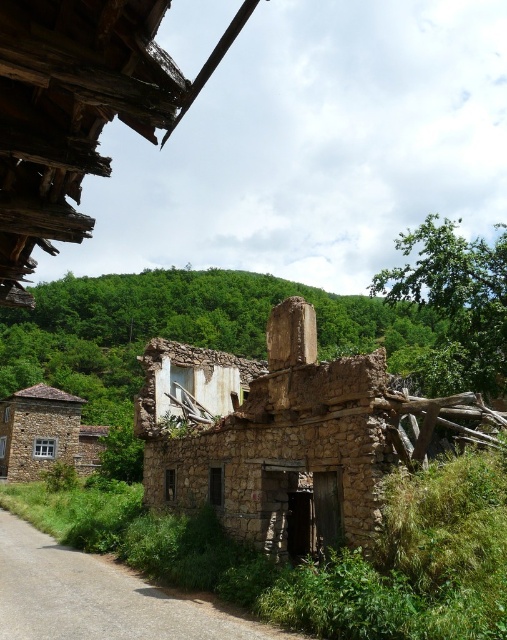
Which is in front, point (295, 401) or point (28, 477)?

Point (295, 401) is more forward.

Does stone rubble at center lie behind stone/tiled hut at lower left?

No.

The width and height of the screenshot is (507, 640). In order to click on stone rubble at center in this screenshot , I will do `click(287, 435)`.

This screenshot has height=640, width=507. I want to click on rusty metal roof at upper left, so click(77, 109).

Based on the photo, does rusty metal roof at upper left have a smaller size compared to stone/tiled hut at lower left?

No, rusty metal roof at upper left is not smaller than stone/tiled hut at lower left.

Is point (80, 230) closer to viewer compared to point (33, 461)?

Yes, it is.

Where is `rusty metal roof at upper left`? The image size is (507, 640). rusty metal roof at upper left is located at coordinates (77, 109).

Consider the image. Can you confirm if stone rubble at center is thinner than rusty metal roof at upper left?

No.

Find the location of a particular element. The image size is (507, 640). stone rubble at center is located at coordinates (287, 435).